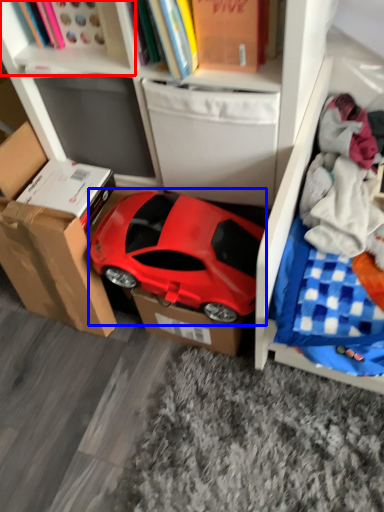
Question: Which of the following is the closest to the observer, cabinet (highlighted by a red box) or car (highlighted by a blue box)?

Choices:
 (A) cabinet
 (B) car

Answer: (A)